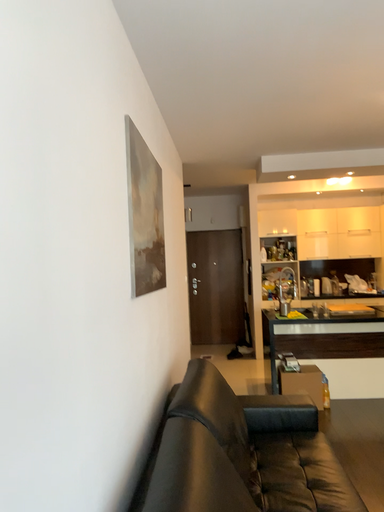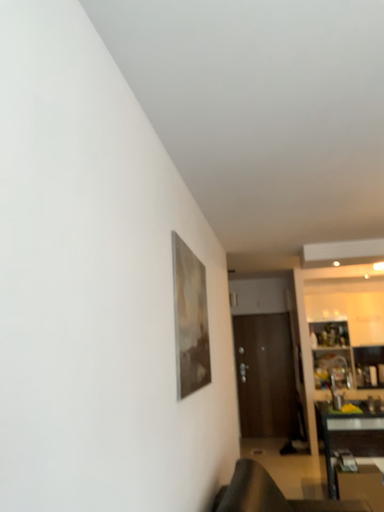
Question: How did the camera likely rotate when shooting the video?

Choices:
 (A) rotated upward
 (B) rotated downward

Answer: (A)